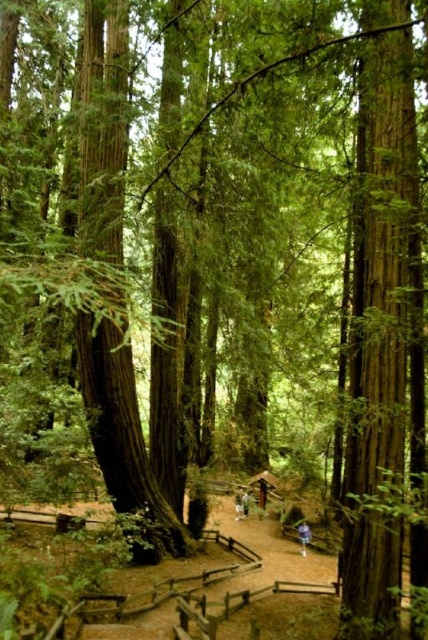
Between light blue denim jeans at center and light blue jeans at center, which one is positioned higher?

light blue jeans at center is higher up.

Is point (240, 509) positioned before point (249, 497)?

No, it is behind (249, 497).

Locate an element on the screen. The height and width of the screenshot is (640, 428). light blue denim jeans at center is located at coordinates (237, 506).

Is blue fabric person at center bigger than light blue denim jeans at center?

Indeed, blue fabric person at center has a larger size compared to light blue denim jeans at center.

Is point (300, 536) more distant than point (237, 512)?

No.

Identify the location of blue fabric person at center. tap(303, 536).

Does blue fabric person at center have a larger size compared to light blue jeans at center?

Correct, blue fabric person at center is larger in size than light blue jeans at center.

Who is positioned more to the right, blue fabric person at center or light blue jeans at center?

From the viewer's perspective, blue fabric person at center appears more on the right side.

Describe the element at coordinates (303, 536) in the screenshot. I see `blue fabric person at center` at that location.

Image resolution: width=428 pixels, height=640 pixels. What are the coordinates of `blue fabric person at center` in the screenshot? It's located at (303, 536).